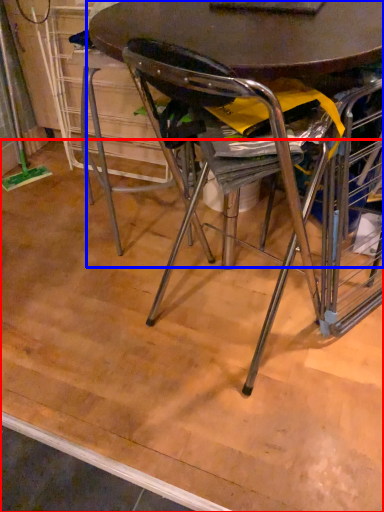
Question: Which object is closer to the camera taking this photo, plywood (highlighted by a red box) or table (highlighted by a blue box)?

Choices:
 (A) plywood
 (B) table

Answer: (B)